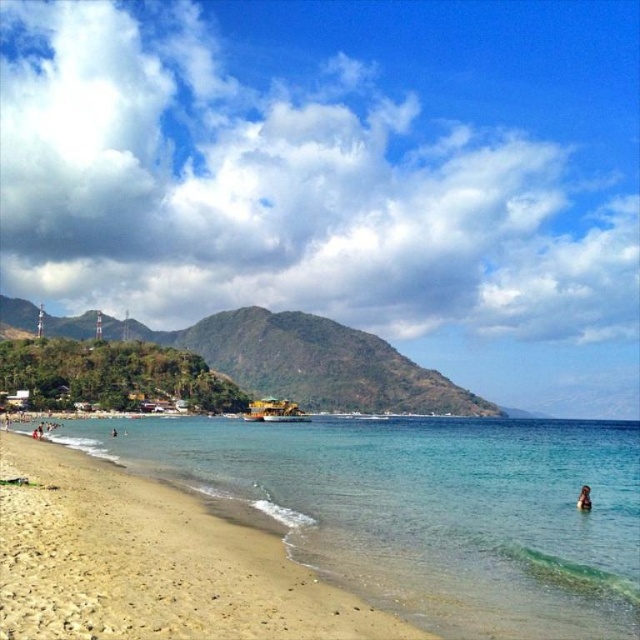
Does light brown sand at lower left have a larger size compared to brown leather person at lower right?

Correct, light brown sand at lower left is larger in size than brown leather person at lower right.

Can you confirm if light brown sand at lower left is positioned above brown leather person at lower right?

Yes, light brown sand at lower left is above brown leather person at lower right.

Is point (122, 506) closer to camera compared to point (582, 497)?

That is True.

This screenshot has height=640, width=640. What are the coordinates of `light brown sand at lower left` in the screenshot? It's located at (150, 563).